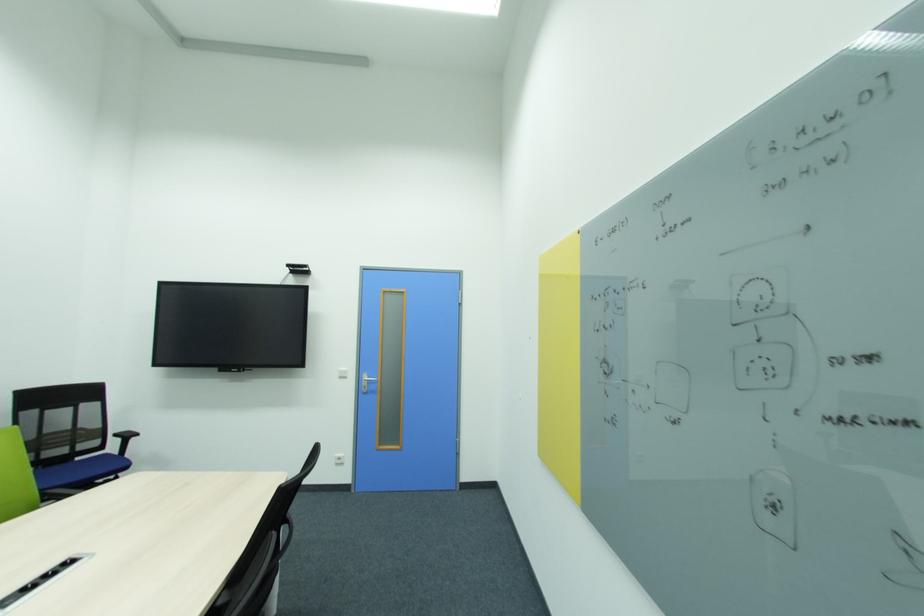
What do you see at coordinates (262, 552) in the screenshot? I see `the black chair armrest` at bounding box center [262, 552].